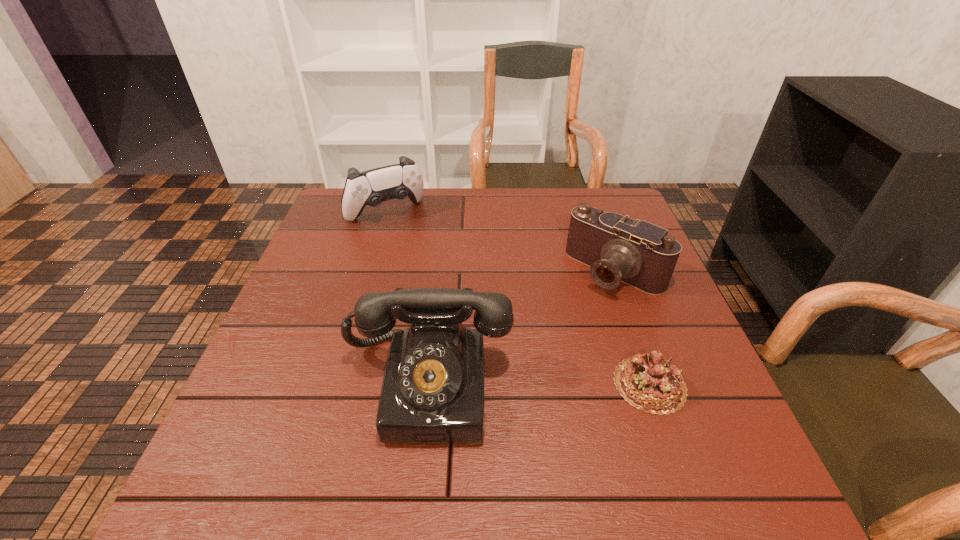
This screenshot has width=960, height=540. I want to click on vacant space at the near edge of the desktop, so click(523, 432).

The height and width of the screenshot is (540, 960). In the image, there is a desktop. What are the coordinates of `vacant space at the left edge` in the screenshot? It's located at (309, 285).

Where is `vacant space at the right edge`? vacant space at the right edge is located at coordinates (636, 355).

Where is `blank region between the chocolate cake and the farthest object`? blank region between the chocolate cake and the farthest object is located at coordinates (517, 299).

Locate an element on the screen. Image resolution: width=960 pixels, height=540 pixels. vacant region between the shortest object and the control is located at coordinates (517, 299).

The height and width of the screenshot is (540, 960). What are the coordinates of `free space between the farthest object and the shortest object` in the screenshot? It's located at (517, 299).

You are a GUI agent. You are given a task and a screenshot of the screen. Output one action in this format:
    pyautogui.click(x=<x>, y=<y>)
    Task: Click on the unoccupied area between the second farthest object and the tallest object
    Image resolution: width=960 pixels, height=540 pixels.
    Given the screenshot: What is the action you would take?
    (x=521, y=328)

This screenshot has width=960, height=540. Identify the location of free space between the telephone and the camera. (521, 328).

Where is `unoccupied position between the shortest object and the control`? This screenshot has width=960, height=540. unoccupied position between the shortest object and the control is located at coordinates pos(517,299).

I want to click on free spot between the camera and the telephone, so click(521, 328).